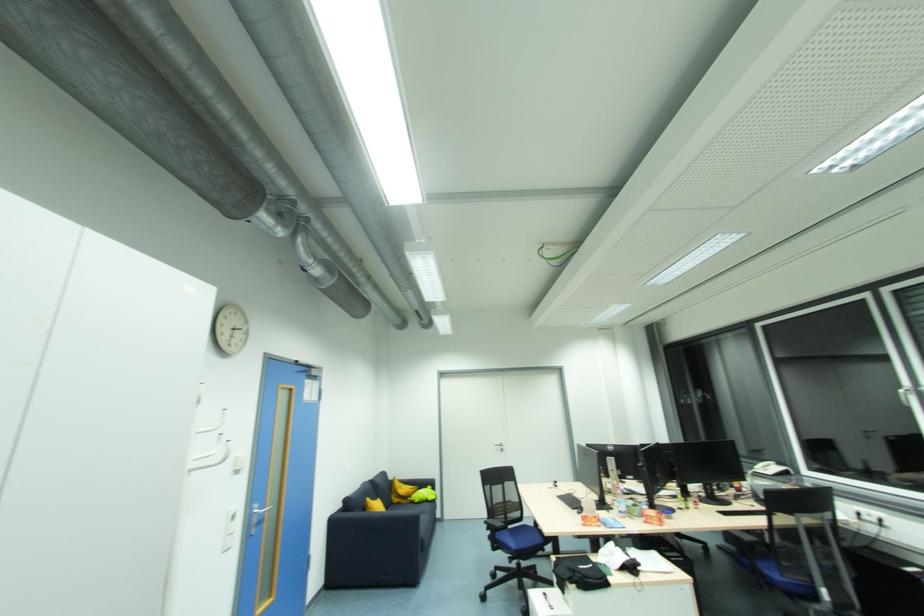
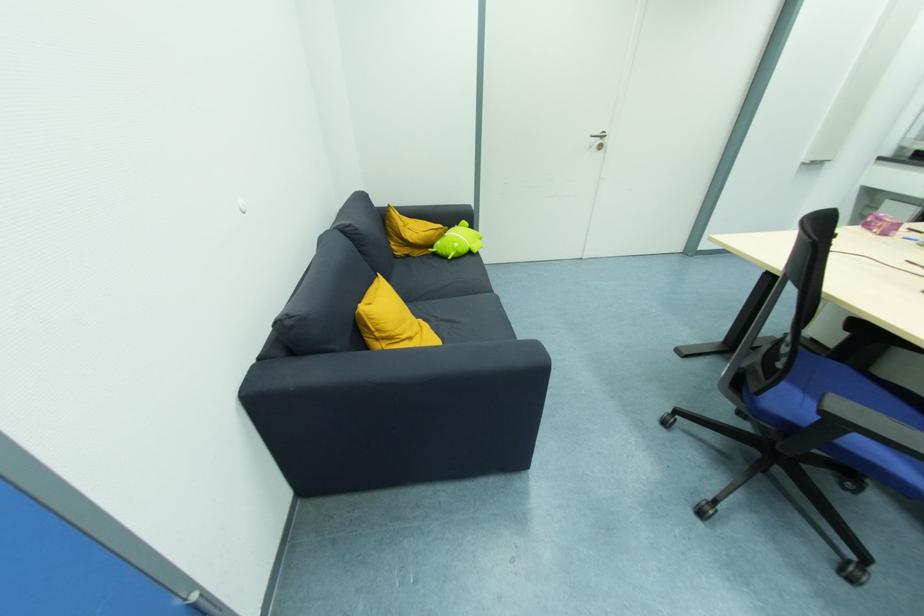
In the second image, find the point that corresponds to pixel 412 499 in the first image.

(435, 248)